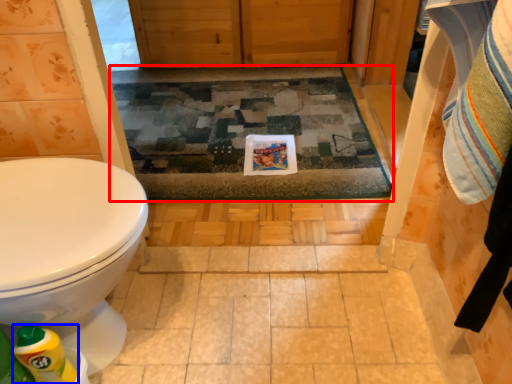
Question: Which object appears closest to the camera in this image, bath mat (highlighted by a red box) or cleaning product (highlighted by a blue box)?

Choices:
 (A) bath mat
 (B) cleaning product

Answer: (B)